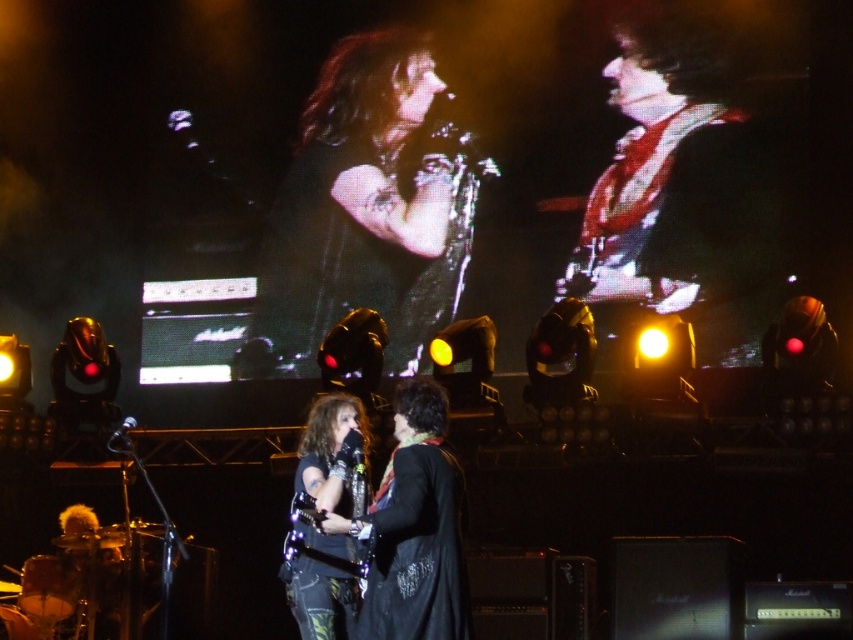
You are a photographer at the concert. You want to capture a photo where both the shiny black leather jacket at center and the shiny red guitar at upper right are clearly visible. Given their sizes, which object should you focus on first to ensure both are in frame?

The shiny black leather jacket at center is smaller than the shiny red guitar at upper right, so you should focus on the shiny red guitar at upper right first to ensure both are in frame.

Consider the image. You are a photographer at the concert and want to capture a photo where both the shiny black leather jacket at center and the shiny red guitar at upper right are clearly visible. However, the guitar is currently blocking part of the jacket. Can you adjust your position to ensure both are fully visible without any obstruction?

The shiny red guitar at upper right is behind the shiny black leather jacket at center, so moving your position slightly to the side might allow you to capture both objects without obstruction.